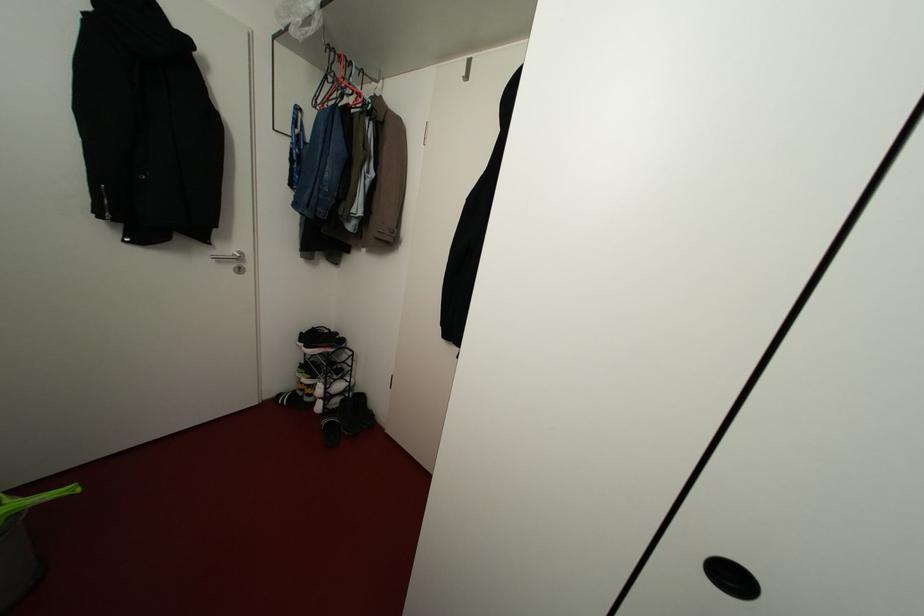
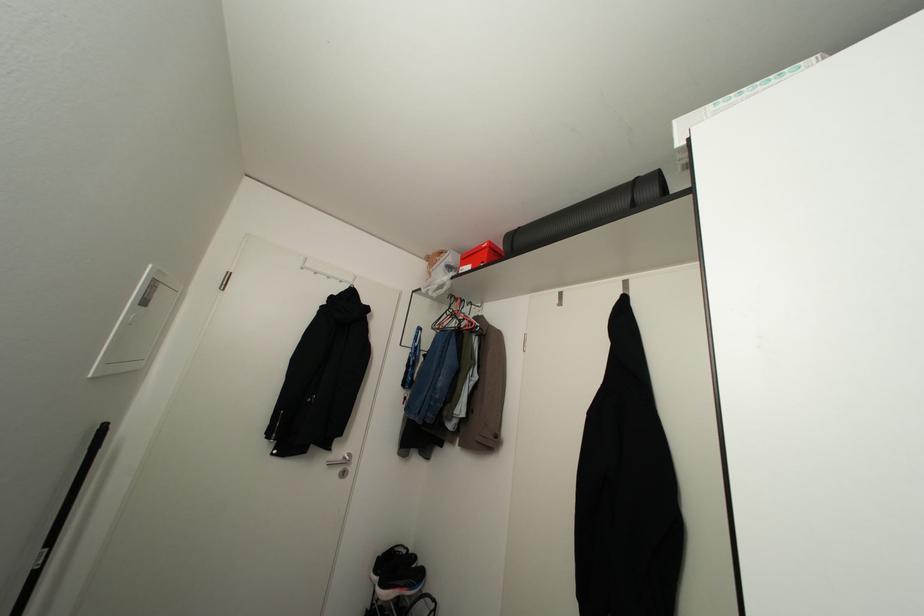
In the second image, find the point that corresponds to (238,270) in the first image.

(343, 472)